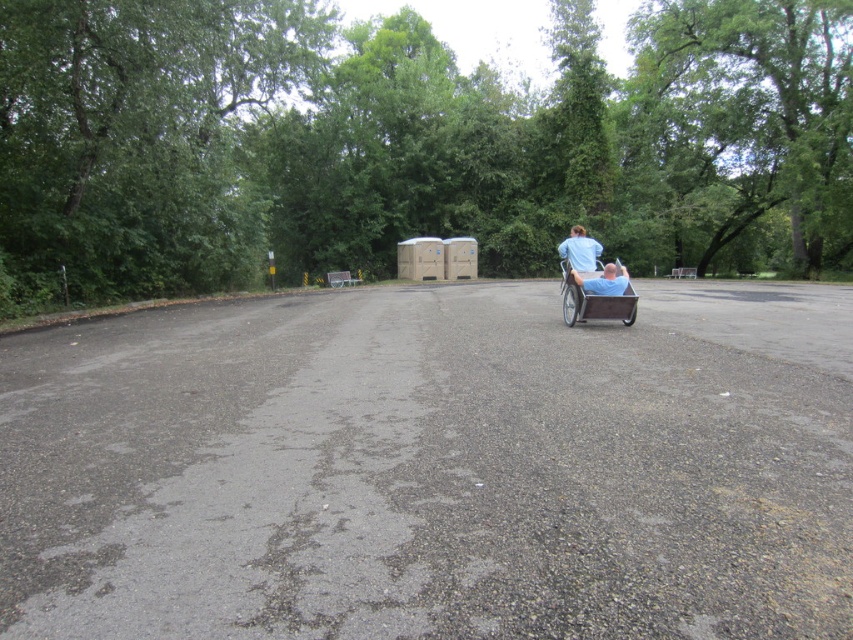
You are standing at the start of the rural road and want to locate the blue fabric shirt at center. According to the coordinates provided, in which direction should you look relative to the road?

The blue fabric shirt at center is located at coordinates point (579, 250). Since the road curves gently to the left in the foreground and continues straight into the background, you should look towards the center of the image where the coordinates indicate the shirt is positioned.

You are standing at the point with coordinates point (595,256) and want to walk towards the portable toilets on the right side of the road. Which direction should you move relative to the point (576,284)?

Since point (576,284) is closer to the camera than point (595,256), you should move towards the direction of point (576,284) to reach the portable toilets on the right side of the road.